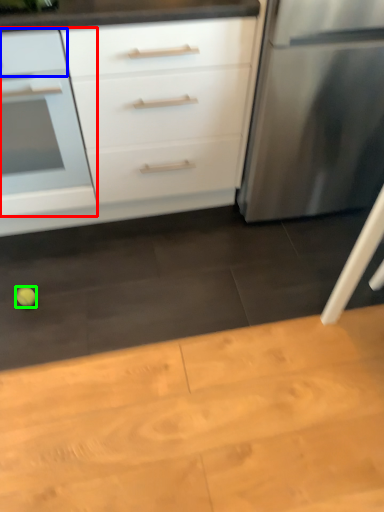
Question: Based on their relative distances, which object is farther from drawer (highlighted by a red box)? Choose from drawer (highlighted by a blue box) and lime (highlighted by a green box).

Choices:
 (A) drawer
 (B) lime

Answer: (B)